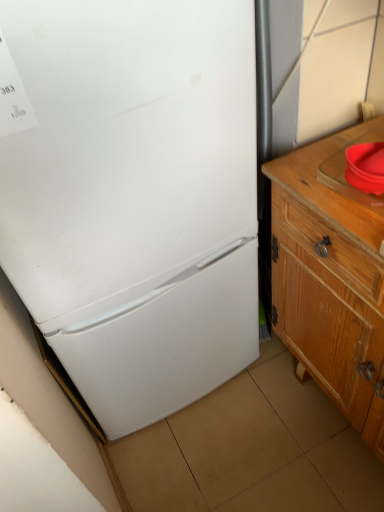
Question: Considering the relative sizes of white matte refrigerator at left and red plastic sink at right in the image provided, is white matte refrigerator at left bigger than red plastic sink at right?

Choices:
 (A) no
 (B) yes

Answer: (B)

Question: Does white matte refrigerator at left turn towards red plastic sink at right?

Choices:
 (A) no
 (B) yes

Answer: (A)

Question: From a real-world perspective, is white matte refrigerator at left below red plastic sink at right?

Choices:
 (A) no
 (B) yes

Answer: (B)

Question: Does white matte refrigerator at left have a lesser width compared to red plastic sink at right?

Choices:
 (A) no
 (B) yes

Answer: (A)

Question: Can you confirm if white matte refrigerator at left is positioned to the right of red plastic sink at right?

Choices:
 (A) no
 (B) yes

Answer: (A)

Question: Is white matte refrigerator at left positioned behind red plastic sink at right?

Choices:
 (A) no
 (B) yes

Answer: (A)

Question: Does wooden cabinet at right appear on the right side of red plastic sink at right?

Choices:
 (A) yes
 (B) no

Answer: (A)

Question: Does wooden cabinet at right have a greater height compared to red plastic sink at right?

Choices:
 (A) yes
 (B) no

Answer: (A)

Question: From a real-world perspective, is wooden cabinet at right on red plastic sink at right?

Choices:
 (A) no
 (B) yes

Answer: (A)

Question: Can you confirm if wooden cabinet at right is positioned to the left of red plastic sink at right?

Choices:
 (A) yes
 (B) no

Answer: (B)

Question: Is wooden cabinet at right positioned with its back to red plastic sink at right?

Choices:
 (A) yes
 (B) no

Answer: (B)

Question: Is wooden cabinet at right positioned beyond the bounds of red plastic sink at right?

Choices:
 (A) yes
 (B) no

Answer: (A)

Question: Is white matte refrigerator at left oriented towards wooden cabinet at right?

Choices:
 (A) no
 (B) yes

Answer: (A)